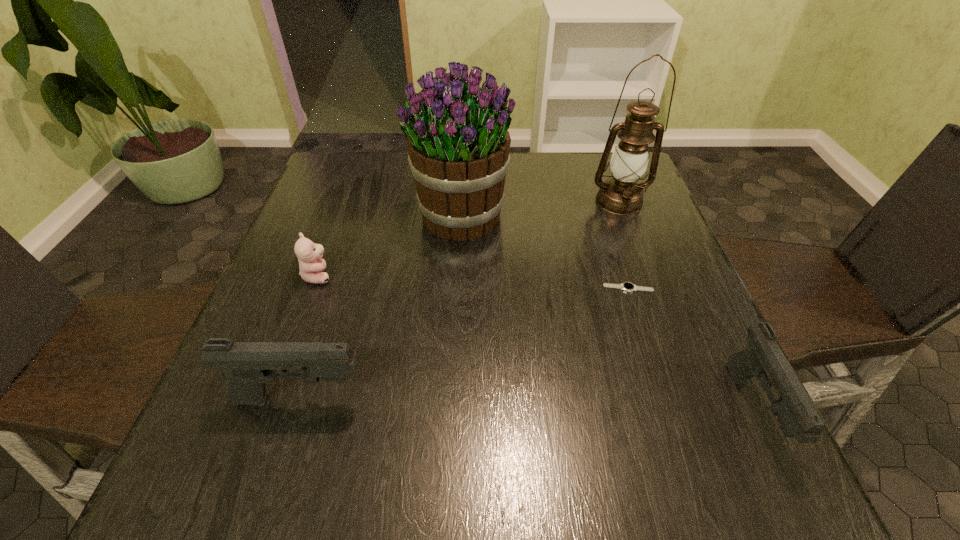
Identify the location of free space that satisfies the following two spatial constraints: 1. on the front side of the oil lamp; 2. at the barrel of the fourth shortest object. (694, 399).

Where is `free region that satisfies the following two spatial constraints: 1. at the face of the watch; 2. on the right side of the teddy bear`? The image size is (960, 540). free region that satisfies the following two spatial constraints: 1. at the face of the watch; 2. on the right side of the teddy bear is located at coordinates (313, 288).

I want to click on free region that satisfies the following two spatial constraints: 1. at the face of the teddy bear; 2. on the back side of the watch, so click(313, 288).